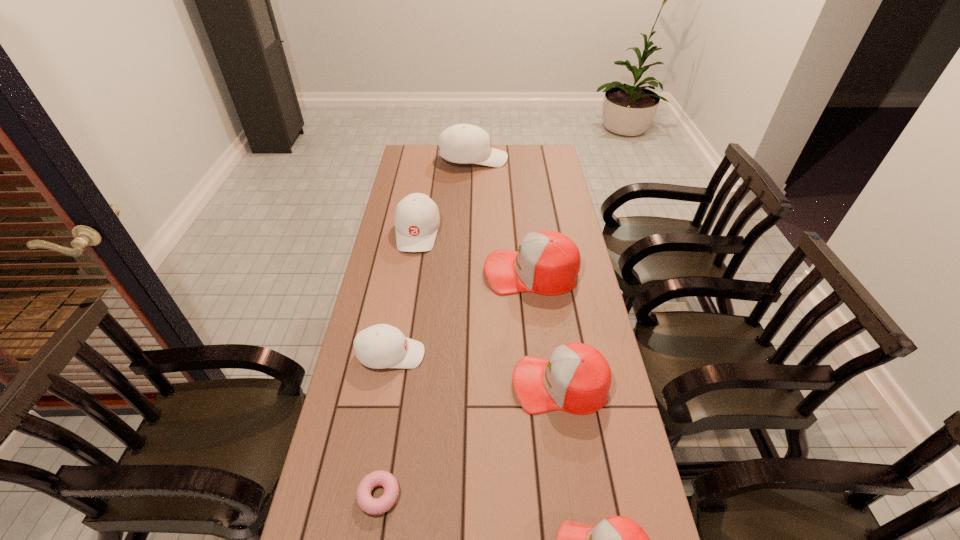
The image size is (960, 540). I want to click on the farthest object, so click(463, 143).

I want to click on the farthest white baseball cap, so click(x=463, y=143).

Identify the location of the farthest red baseball cap. (547, 262).

Locate an element on the screen. the second farthest white baseball cap is located at coordinates (417, 219).

Find the location of `the second farthest red baseball cap`. the second farthest red baseball cap is located at coordinates (577, 378).

Locate an element on the screen. the nearest white baseball cap is located at coordinates (380, 346).

Locate an element on the screen. doughnut is located at coordinates (368, 504).

This screenshot has width=960, height=540. Find the location of `the shortest object`. the shortest object is located at coordinates (368, 504).

You are a GUI agent. You are given a task and a screenshot of the screen. Output one action in this format:
    pyautogui.click(x=<x>, y=<y>)
    Task: Click on the vacant space located 0.120m on the front-facing side of the farthest baseball cap
    The image size is (960, 540).
    Given the screenshot: What is the action you would take?
    pyautogui.click(x=533, y=159)

Find the location of a particular element. This screenshot has width=960, height=540. free space located on the front-facing side of the farthest red baseball cap is located at coordinates (433, 272).